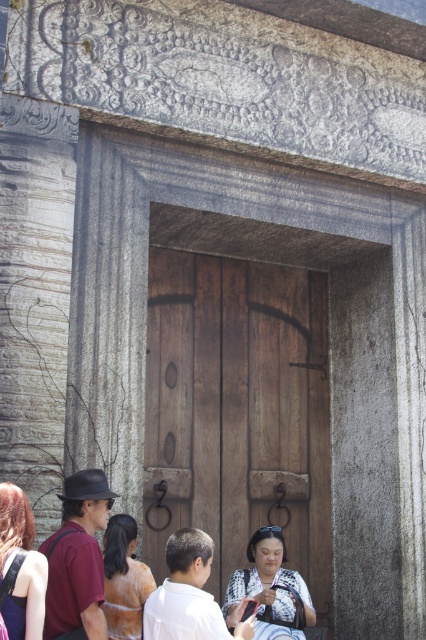
Question: Which object is positioned farthest from the white matte shirt at center?

Choices:
 (A) brown wooden door at center
 (B) matte black hat at left

Answer: (A)

Question: Is white printed blouse at center wider than matte orange dress at center?

Choices:
 (A) yes
 (B) no

Answer: (A)

Question: Considering the real-world distances, which object is closest to the matte black hair at lower left?

Choices:
 (A) matte orange dress at center
 (B) white matte shirt at center
 (C) matte black hat at left
 (D) brown wooden door at center

Answer: (C)

Question: Where is brown wooden door at center located in relation to white printed blouse at center in the image?

Choices:
 (A) right
 (B) left

Answer: (B)

Question: Is white matte shirt at center above white printed blouse at center?

Choices:
 (A) no
 (B) yes

Answer: (B)

Question: Estimate the real-world distances between objects in this image. Which object is closer to the wooden door at center?

Choices:
 (A) brown wooden door at center
 (B) white matte shirt at center
 (C) matte black hat at left

Answer: (A)